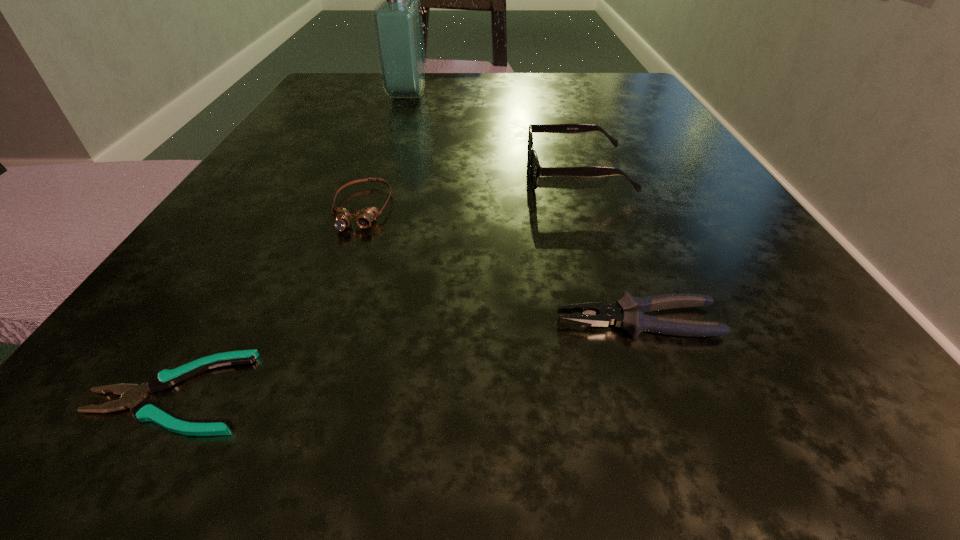
Find the location of a particular element. The image size is (960, 540). free spot located at the front lenses of the sunglasses is located at coordinates (365, 173).

Locate an element on the screen. The width and height of the screenshot is (960, 540). free space located at the front lenses of the sunglasses is located at coordinates (465, 173).

You are a GUI agent. You are given a task and a screenshot of the screen. Output one action in this format:
    pyautogui.click(x=<x>, y=<y>)
    Task: Click on the free space located on the front lenses and sides of the goggles
    
    Given the screenshot: What is the action you would take?
    pyautogui.click(x=294, y=397)

At what (x,y) coordinates should I click in order to perform the action: click on blank space located at the gripping part of the farther pliers. Please return your answer as a coordinate pair (x, y). Image resolution: width=960 pixels, height=540 pixels. Looking at the image, I should click on coord(321,321).

Locate an element on the screen. This screenshot has height=540, width=960. free region located at the gripping part of the farther pliers is located at coordinates (289, 321).

What are the coordinates of `vacant space situated 0.330m at the gripping part of the farther pliers` in the screenshot? It's located at (203, 321).

This screenshot has height=540, width=960. Find the location of `free space located 0.290m on the right of the shorter pliers`. free space located 0.290m on the right of the shorter pliers is located at coordinates (612, 393).

Locate an element on the screen. The height and width of the screenshot is (540, 960). object located at the far edge is located at coordinates (397, 20).

This screenshot has height=540, width=960. I want to click on object situated at the near edge, so click(x=144, y=410).

Where is `perfume that is at the left edge`? The height and width of the screenshot is (540, 960). perfume that is at the left edge is located at coordinates (397, 20).